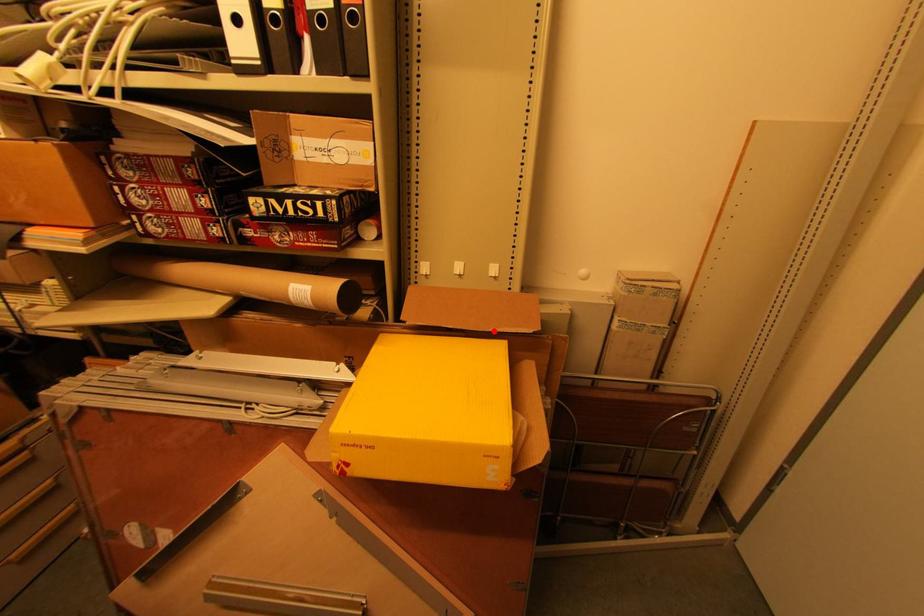
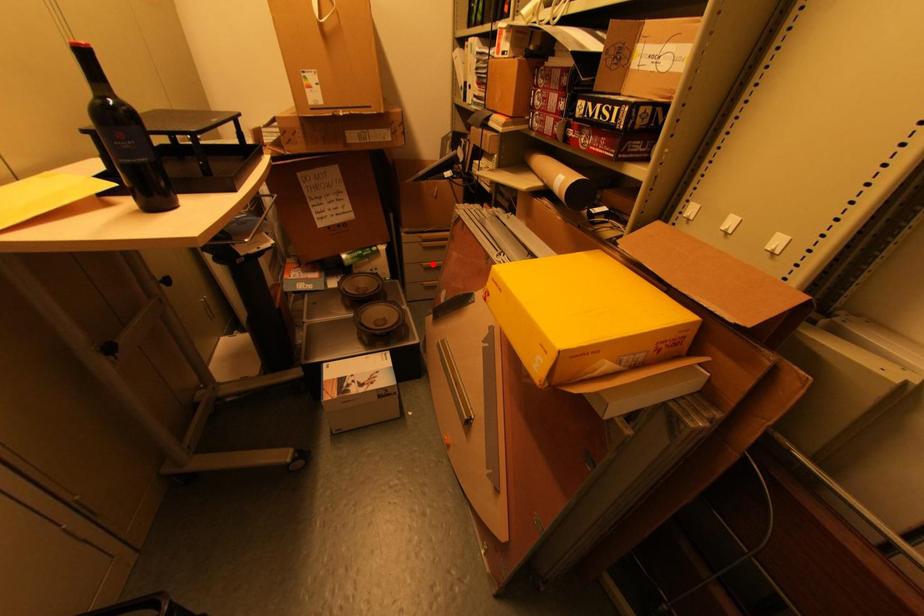
I am providing you with two images of the same scene from different viewpoints. A red point is marked on the first image and another point is marked on the second image. Do the highlighted points in image1 and image2 indicate the same real-world spot?

No